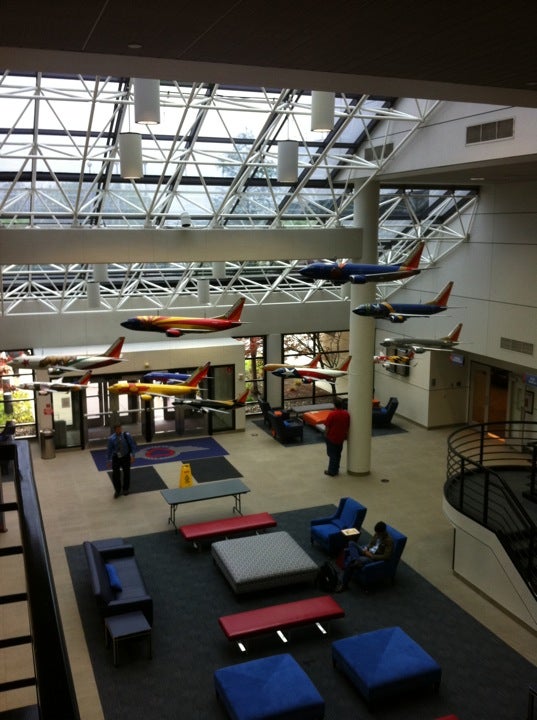
Locate an element on the screen. The width and height of the screenshot is (537, 720). wet floor sign is located at coordinates (185, 474).